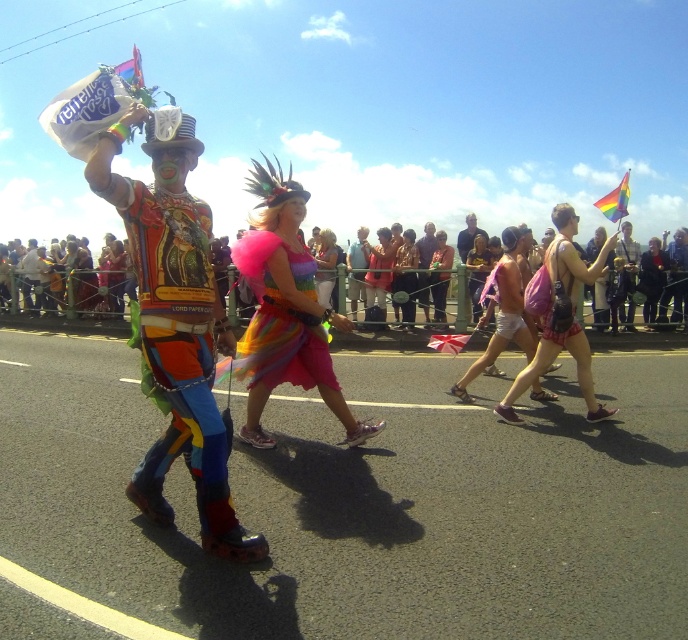
Question: Which object is farther from the camera taking this photo?

Choices:
 (A) multicolored fabric costume at center
 (B) rainbow tulle dress at center

Answer: (B)

Question: Which object is positioned farthest from the multicolored fabric costume at center?

Choices:
 (A) rainbow tulle dress at center
 (B) matte pink shorts at center
 (C) rainbow tulle skirt at center

Answer: (B)

Question: Is multicolored fabric costume at center closer to the viewer compared to rainbow tulle skirt at center?

Choices:
 (A) yes
 (B) no

Answer: (A)

Question: Can you confirm if multicolored fabric costume at center is positioned below matte pink shorts at center?

Choices:
 (A) no
 (B) yes

Answer: (B)

Question: Is multicolored fabric costume at center thinner than rainbow tulle dress at center?

Choices:
 (A) yes
 (B) no

Answer: (A)

Question: Based on their relative distances, which object is farther from the matte pink shorts at center?

Choices:
 (A) rainbow tulle skirt at center
 (B) multicolored fabric costume at center

Answer: (B)